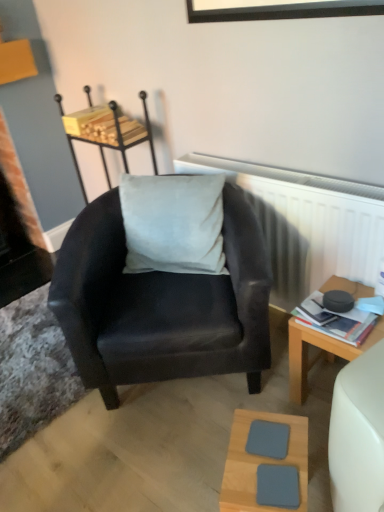
You are a GUI agent. You are given a task and a screenshot of the screen. Output one action in this format:
    pyautogui.click(x=<x>, y=<y>)
    Task: Click on the empty space that is ontop of light wood/texture square coaster at lower center
    
    Given the screenshot: What is the action you would take?
    pyautogui.click(x=271, y=456)